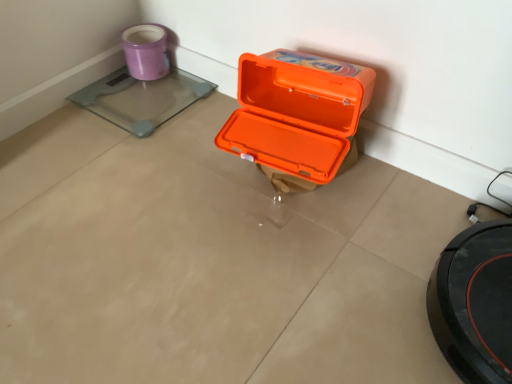
The width and height of the screenshot is (512, 384). In order to click on vacant location below orange plastic box at center (from a real-world perspective) in this screenshot , I will do `click(287, 182)`.